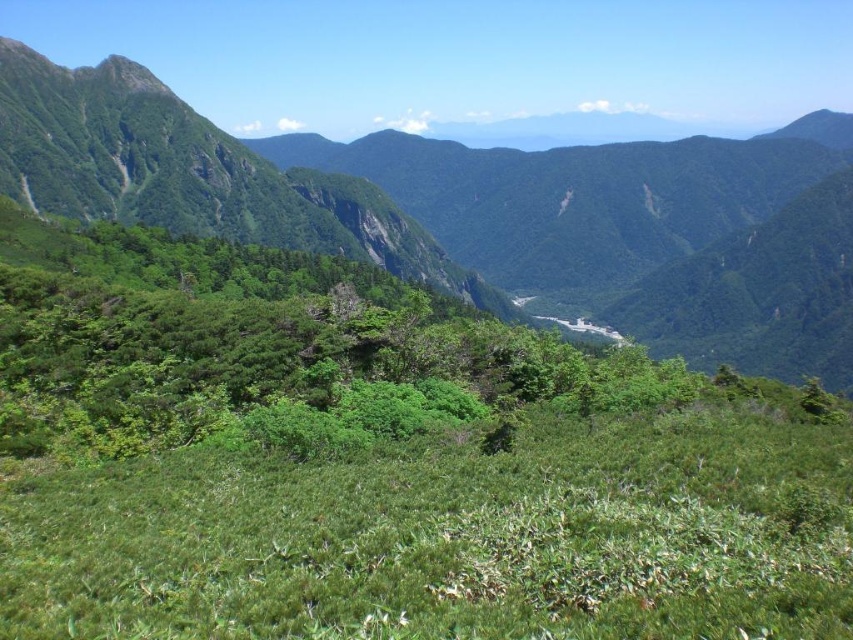
Does green leafy grass at center have a larger size compared to green leafy vegetation at center?

No, green leafy grass at center is not bigger than green leafy vegetation at center.

Can you confirm if green leafy grass at center is taller than green leafy vegetation at center?

No.

Where is `green leafy grass at center`? This screenshot has width=853, height=640. green leafy grass at center is located at coordinates click(x=450, y=538).

Image resolution: width=853 pixels, height=640 pixels. What are the coordinates of `green leafy grass at center` in the screenshot? It's located at (450, 538).